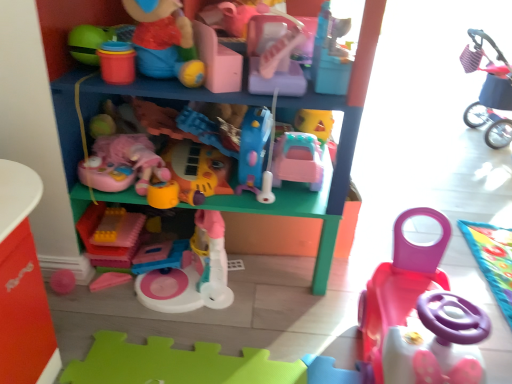
Question: From the image's perspective, is plush pink stroller at upper right, which ranks as the 8th toy in left-to-right order, over pink plastic car at center, the 4th toy from the right?

Choices:
 (A) yes
 (B) no

Answer: (A)

Question: From a real-world perspective, does plush pink stroller at upper right, which ranks as the first toy in right-to-left order, stand above pink plastic car at center, arranged as the 5th toy when viewed from the left?

Choices:
 (A) yes
 (B) no

Answer: (B)

Question: Does plush pink stroller at upper right, which ranks as the first toy in right-to-left order, come in front of pink plastic car at center, arranged as the 5th toy when viewed from the left?

Choices:
 (A) no
 (B) yes

Answer: (A)

Question: Can you confirm if plush pink stroller at upper right, which ranks as the first toy in right-to-left order, is bigger than pink plastic car at center, arranged as the 5th toy when viewed from the left?

Choices:
 (A) yes
 (B) no

Answer: (A)

Question: Considering the relative sizes of plush pink stroller at upper right, which ranks as the first toy in right-to-left order, and pink plastic car at center, arranged as the 5th toy when viewed from the left, in the image provided, is plush pink stroller at upper right, which ranks as the first toy in right-to-left order, taller than pink plastic car at center, arranged as the 5th toy when viewed from the left,?

Choices:
 (A) yes
 (B) no

Answer: (A)

Question: Based on their sizes in the image, would you say translucent yellow plastic blocks at center, placed as the eighth toy when sorted from right to left, is bigger or smaller than pink plastic toy car at lower right, marked as the 2th toy in a right-to-left arrangement?

Choices:
 (A) big
 (B) small

Answer: (B)

Question: Considering the positions of translucent yellow plastic blocks at center, placed as the eighth toy when sorted from right to left, and pink plastic toy car at lower right, marked as the 2th toy in a right-to-left arrangement, in the image, is translucent yellow plastic blocks at center, placed as the eighth toy when sorted from right to left, wider or thinner than pink plastic toy car at lower right, marked as the 2th toy in a right-to-left arrangement,?

Choices:
 (A) thin
 (B) wide

Answer: (A)

Question: Do you think translucent yellow plastic blocks at center, placed as the eighth toy when sorted from right to left, is within pink plastic toy car at lower right, marked as the 2th toy in a right-to-left arrangement, or outside of it?

Choices:
 (A) inside
 (B) outside

Answer: (B)

Question: From a real-world perspective, relative to pink plastic toy car at lower right, marked as the 2th toy in a right-to-left arrangement, is translucent yellow plastic blocks at center, placed as the eighth toy when sorted from right to left, vertically above or below?

Choices:
 (A) above
 (B) below

Answer: (B)

Question: Considering the positions of matte plastic toy car at lower right and translucent yellow plastic blocks at center, placed as the eighth toy when sorted from right to left, in the image, is matte plastic toy car at lower right bigger or smaller than translucent yellow plastic blocks at center, placed as the eighth toy when sorted from right to left,?

Choices:
 (A) small
 (B) big

Answer: (B)

Question: Considering their positions, is matte plastic toy car at lower right located in front of or behind translucent yellow plastic blocks at center, the first toy when ordered from left to right?

Choices:
 (A) behind
 (B) front

Answer: (B)

Question: From the image's perspective, is matte plastic toy car at lower right located above or below translucent yellow plastic blocks at center, the first toy when ordered from left to right?

Choices:
 (A) below
 (B) above

Answer: (B)

Question: Considering the positions of matte plastic toy car at lower right and translucent yellow plastic blocks at center, the first toy when ordered from left to right, in the image, is matte plastic toy car at lower right taller or shorter than translucent yellow plastic blocks at center, the first toy when ordered from left to right,?

Choices:
 (A) tall
 (B) short

Answer: (A)

Question: From a real-world perspective, is pink plastic toy at center, the 7th toy in the right-to-left sequence, above or below matte plastic toy at upper center, the 5th toy viewed from the right?

Choices:
 (A) above
 (B) below

Answer: (B)

Question: Is pink plastic toy at center, marked as the 2th toy in a left-to-right arrangement, inside the boundaries of matte plastic toy at upper center, the fourth toy positioned from the left, or outside?

Choices:
 (A) inside
 (B) outside

Answer: (B)